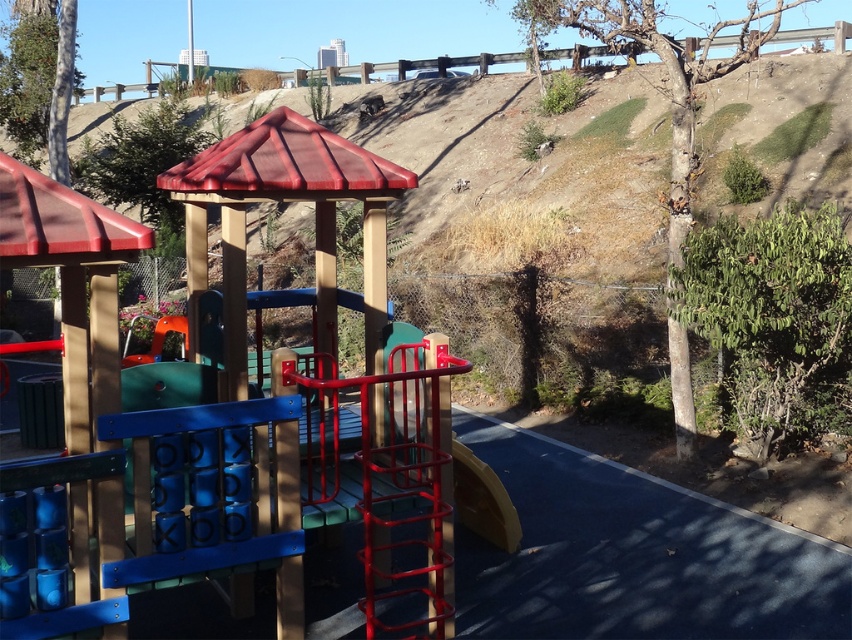
Who is more distant from viewer, [354,164] or [510,545]?

The point [510,545] is behind.

Identify the location of wooden playground structure at center. (225, 408).